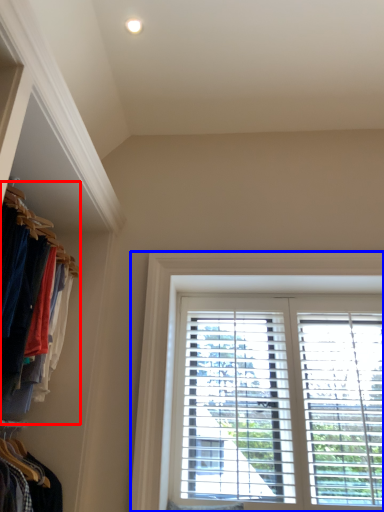
Question: Which point is further to the camera, closet (highlighted by a red box) or window (highlighted by a blue box)?

Choices:
 (A) closet
 (B) window

Answer: (B)